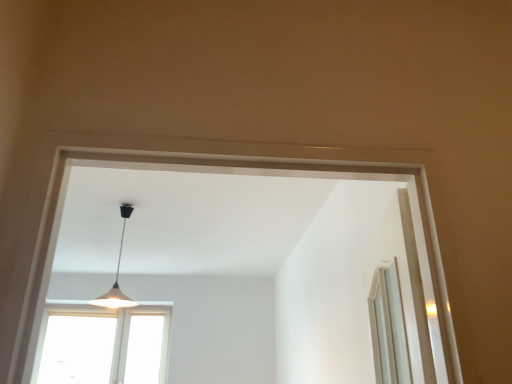
Question: Is point (95, 374) closer or farther from the camera than point (126, 211)?

Choices:
 (A) farther
 (B) closer

Answer: (A)

Question: Looking at their shapes, would you say transparent glass window at lower left is wider or thinner than white matte lampshade at center?

Choices:
 (A) thin
 (B) wide

Answer: (A)

Question: From a real-world perspective, relative to white matte lampshade at center, is transparent glass window at lower left vertically above or below?

Choices:
 (A) above
 (B) below

Answer: (B)

Question: Based on their positions, is white matte lampshade at center located to the left or right of transparent glass window at lower left?

Choices:
 (A) left
 (B) right

Answer: (B)

Question: Looking at their shapes, would you say white matte lampshade at center is wider or thinner than transparent glass window at lower left?

Choices:
 (A) thin
 (B) wide

Answer: (B)

Question: Considering the positions of point tap(117, 281) and point tap(51, 342), is point tap(117, 281) closer or farther from the camera than point tap(51, 342)?

Choices:
 (A) closer
 (B) farther

Answer: (B)

Question: Based on their sizes in the image, would you say white matte lampshade at center is bigger or smaller than transparent glass window at lower left?

Choices:
 (A) small
 (B) big

Answer: (A)